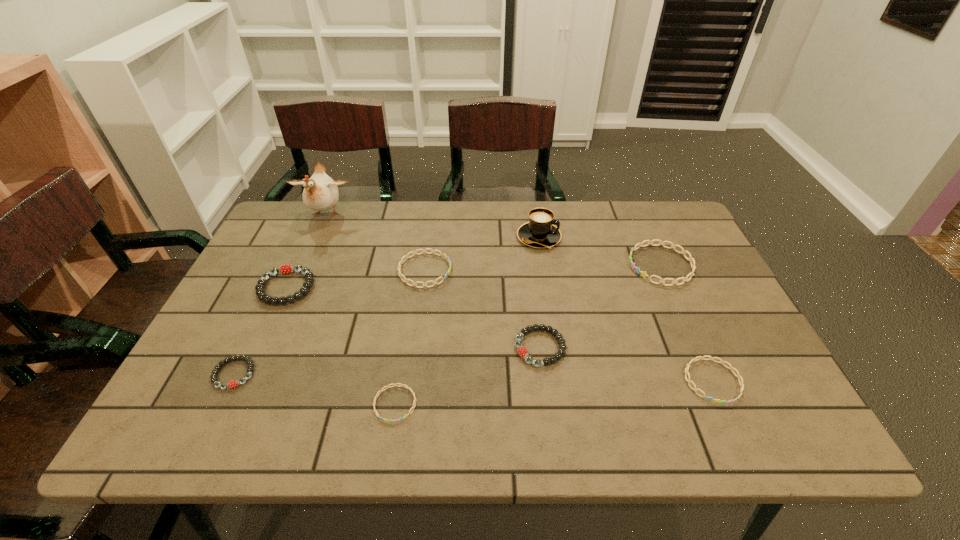
At what (x,y) coordinates should I click in order to perform the action: click on blue bracelet identified as the third closest to the biggest blue bracelet. Please return your answer as a coordinate pair (x, y). The width and height of the screenshot is (960, 540). Looking at the image, I should click on (401, 385).

Locate which blue bracelet is the fourth closest to the smallest black bracelet. Please provide its 2D coordinates. Your answer should be formatted as a tuple, i.e. [(x, y)], where the tuple contains the x and y coordinates of a point satisfying the conditions above.

[(643, 274)]

Point out which black bracelet is positioned as the third nearest to the tallest object. Please provide its 2D coordinates. Your answer should be formatted as a tuple, i.e. [(x, y)], where the tuple contains the x and y coordinates of a point satisfying the conditions above.

[(522, 351)]

The image size is (960, 540). Identify the location of black bracelet that stands as the second closest to the smallest black bracelet. (522, 351).

You are a GUI agent. You are given a task and a screenshot of the screen. Output one action in this format:
    pyautogui.click(x=<x>, y=<y>)
    Task: Click on the vacant space that satisfies the following two spatial constraints: 1. at the beak of the bird; 2. on the right side of the black cappuccino
    
    Given the screenshot: What is the action you would take?
    pyautogui.click(x=316, y=237)

This screenshot has width=960, height=540. Identify the location of free location that satisfies the following two spatial constraints: 1. on the surface of the second biggest blue bracelet showing star-shaped elements; 2. on the surface of the shortest bracelet showing star-shaped elements. (406, 404).